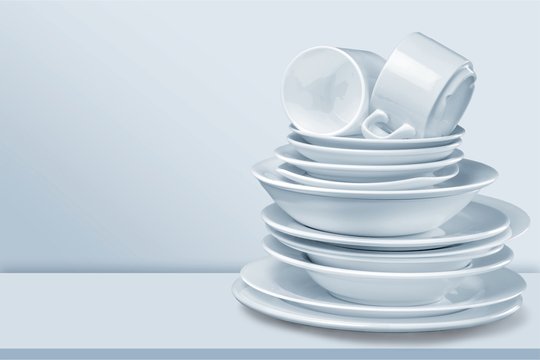
This screenshot has width=540, height=360. I want to click on plates, so click(442, 322), click(451, 307), click(472, 235), click(471, 186), click(401, 184), click(404, 166), click(379, 152), click(383, 144).